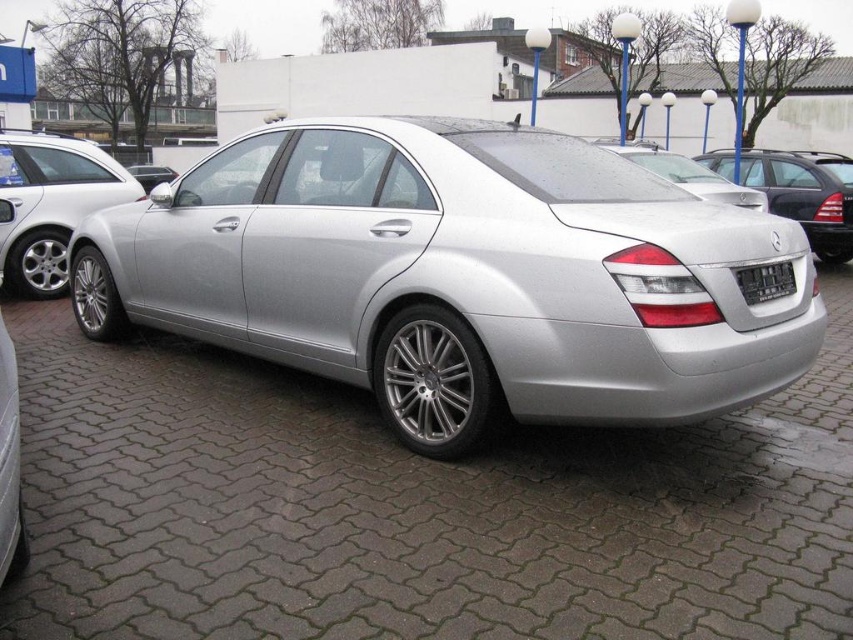
Who is more forward, (523,252) or (833,195)?

Positioned in front is point (523,252).

Is silver metallic car at center behind satin silver car at center?

No, it is in front of satin silver car at center.

You are a GUI agent. You are given a task and a screenshot of the screen. Output one action in this format:
    pyautogui.click(x=<x>, y=<y>)
    Task: Click on the silver metallic car at center
    This screenshot has height=640, width=853.
    Given the screenshot: What is the action you would take?
    pyautogui.click(x=457, y=275)

Between satin silver car at center and black plastic license plate at rear, which one appears on the left side from the viewer's perspective?

Positioned to the left is black plastic license plate at rear.

Between satin silver car at center and black plastic license plate at rear, which one appears on the right side from the viewer's perspective?

satin silver car at center

Is point (766, 170) positioned behind point (792, 291)?

That is True.

Locate an element on the screen. This screenshot has width=853, height=640. satin silver car at center is located at coordinates (805, 195).

Is point (21, 208) more distant than point (758, 280)?

That is True.

Which is in front, point (9, 147) or point (767, 275)?

Point (767, 275) is in front.

Where is `silver metallic sedan at left`? silver metallic sedan at left is located at coordinates (51, 204).